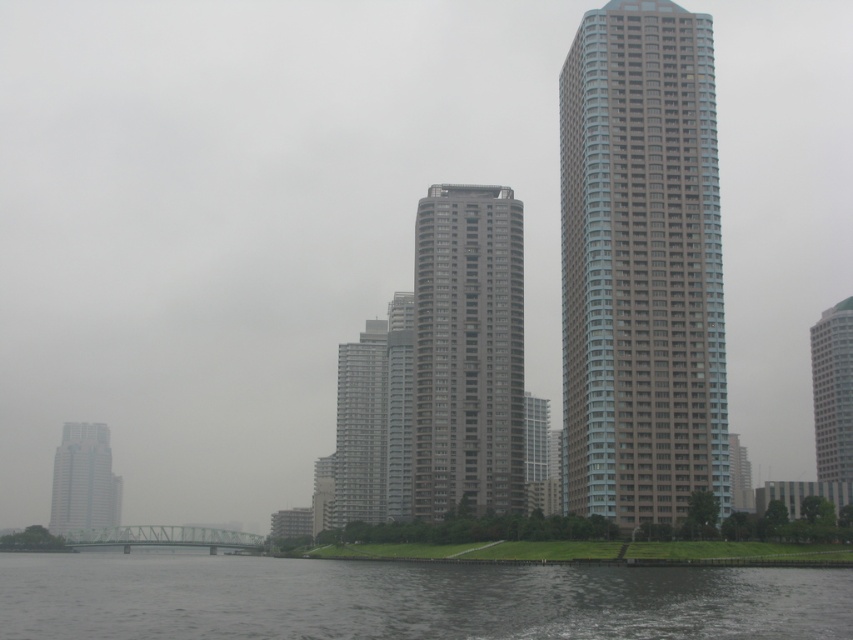
You are standing at the point marked by coordinates point (408,600) in the cityscape image. Looking around, you see dark gray water at lower center. What is directly below you?

The point (408,600) marks dark gray water at lower center, so you are directly above the dark gray water at lower center.

You are standing on the grassy area in the midground and want to cross to the green bridge on the far side of the dark gray water at lower center. To your right, there is a gray glass building at center. In which direction should you head to reach the bridge without going near the building?

You should head to the left of the gray glass building at center because the dark gray water at lower center is to the left of the gray glass building at center, so moving left will take you towards the bridge without approaching the building.

You are standing at the edge of the dark gray water at lower center and want to walk to the gray concrete building at left. Which direction should you head to reach the building?

Since the dark gray water at lower center is closer to the viewer than the gray concrete building at left, you should head towards the left to reach the gray concrete building at left.